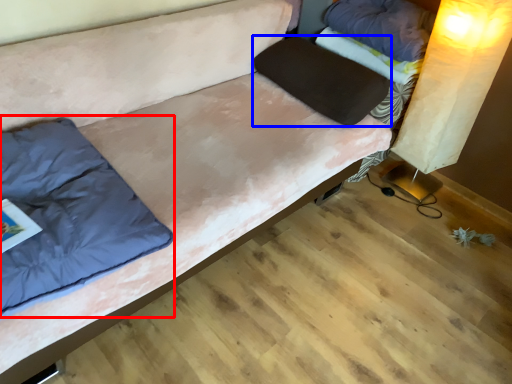
Question: Which point is closer to the camera, pillow (highlighted by a red box) or pillow (highlighted by a blue box)?

Choices:
 (A) pillow
 (B) pillow

Answer: (A)